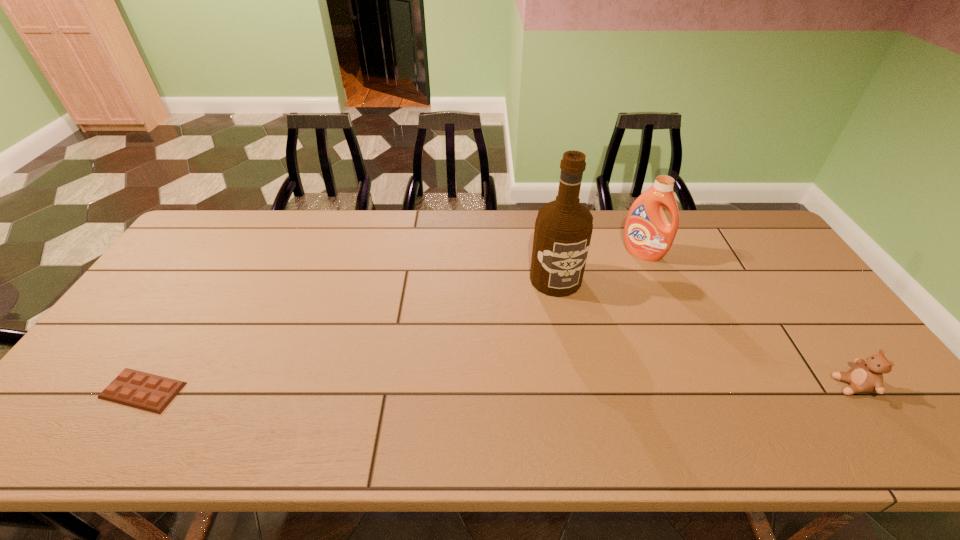
You are a GUI agent. You are given a task and a screenshot of the screen. Output one action in this format:
    pyautogui.click(x=<x>, y=<y>)
    Task: Click on the vacant area between the second object from right to left and the teddy bear
    The height and width of the screenshot is (540, 960).
    Given the screenshot: What is the action you would take?
    pyautogui.click(x=747, y=320)

Identify the location of the third closest object to the second object from right to left. This screenshot has height=540, width=960. (145, 391).

Identify which object is the second closest to the shortest object. Please provide its 2D coordinates. Your answer should be formatted as a tuple, i.e. [(x, y)], where the tuple contains the x and y coordinates of a point satisfying the conditions above.

[(648, 235)]

Where is `blank space that satisfies the following two spatial constraints: 1. on the front side of the teddy bear; 2. on the front-facing side of the detergent`? blank space that satisfies the following two spatial constraints: 1. on the front side of the teddy bear; 2. on the front-facing side of the detergent is located at coordinates (698, 386).

The width and height of the screenshot is (960, 540). Find the location of `vacant area in the image that satisfies the following two spatial constraints: 1. on the back side of the teddy bear; 2. on the front-facing side of the shortest object`. vacant area in the image that satisfies the following two spatial constraints: 1. on the back side of the teddy bear; 2. on the front-facing side of the shortest object is located at coordinates (146, 386).